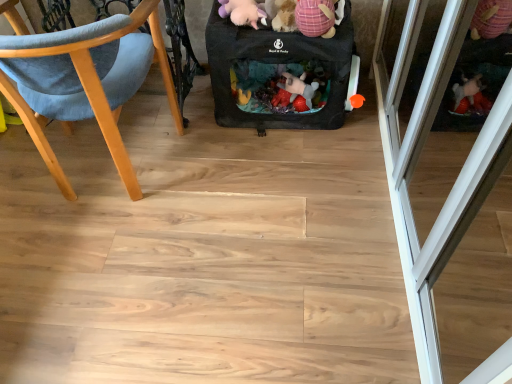
The image size is (512, 384). Describe the element at coordinates (88, 81) in the screenshot. I see `wooden chair at left` at that location.

Where is `purple plush toy at upper center, which is counted as the 2th toy, starting from the right`? This screenshot has width=512, height=384. purple plush toy at upper center, which is counted as the 2th toy, starting from the right is located at coordinates (242, 12).

This screenshot has width=512, height=384. What are the coordinates of `black fabric baby carriage at center` in the screenshot? It's located at (277, 73).

The height and width of the screenshot is (384, 512). There is a wooden chair at left. Find the location of `the 2nd toy above it (from the image's perspective)`. the 2nd toy above it (from the image's perspective) is located at coordinates (242, 12).

Is wooden chair at left to the right of purple plush toy at upper center, which is counted as the 2th toy, starting from the right, from the viewer's perspective?

No.

Which point is more distant from viewer, (51, 55) or (219, 12)?

Point (219, 12)

From a real-world perspective, is wooden chair at left positioned over purple plush toy at upper center, which is counted as the 2th toy, starting from the right, based on gravity?

No, from a real-world perspective, wooden chair at left is not over purple plush toy at upper center, which is counted as the 2th toy, starting from the right

Which is correct: purple plush toy at upper center, which is counted as the 2th toy, starting from the right, is inside black fabric baby carriage at center, or outside of it?

purple plush toy at upper center, which is counted as the 2th toy, starting from the right, lies outside black fabric baby carriage at center.

Who is taller, purple plush toy at upper center, which is counted as the 2th toy, starting from the right, or black fabric baby carriage at center?

With more height is black fabric baby carriage at center.

Is purple plush toy at upper center, which is counted as the 2th toy, starting from the right, oriented away from black fabric baby carriage at center?

No, purple plush toy at upper center, which is counted as the 2th toy, starting from the right, is not facing the opposite direction of black fabric baby carriage at center.

Is purple plush toy at upper center, which is the first toy from left to right, in contact with black fabric baby carriage at center?

No, purple plush toy at upper center, which is the first toy from left to right, is not in contact with black fabric baby carriage at center.

From the image's perspective, between transparent glass screen door at right and wooden chair at left, which one is located above?

wooden chair at left.

Based on the photo, considering the relative sizes of transparent glass screen door at right and wooden chair at left in the image provided, is transparent glass screen door at right thinner than wooden chair at left?

Yes.

Is transparent glass screen door at right facing towards wooden chair at left?

Yes, transparent glass screen door at right is facing wooden chair at left.

What are the coordinates of `chair above the transparent glass screen door at right (from the image's perspective)` in the screenshot? It's located at (88, 81).

Looking at the image, does transparent glass screen door at right seem bigger or smaller compared to purple plush toy at upper center, which is counted as the 2th toy, starting from the right?

In the image, transparent glass screen door at right appears to be larger than purple plush toy at upper center, which is counted as the 2th toy, starting from the right.

Relative to purple plush toy at upper center, which is the first toy from left to right, is transparent glass screen door at right in front or behind?

transparent glass screen door at right is positioned closer to the viewer than purple plush toy at upper center, which is the first toy from left to right.

Is transparent glass screen door at right wider than purple plush toy at upper center, which is counted as the 2th toy, starting from the right?

Yes.

Is pink plaid fabric stuffed animal at upper center, the second toy viewed from the left, facing away from transparent glass screen door at right?

pink plaid fabric stuffed animal at upper center, the second toy viewed from the left, does not have its back to transparent glass screen door at right.

Would you say transparent glass screen door at right is part of pink plaid fabric stuffed animal at upper center, the second toy viewed from the left,'s contents?

No, transparent glass screen door at right is not inside pink plaid fabric stuffed animal at upper center, the second toy viewed from the left.

Does pink plaid fabric stuffed animal at upper center, positioned as the first toy in right-to-left order, have a lesser height compared to transparent glass screen door at right?

Indeed, pink plaid fabric stuffed animal at upper center, positioned as the first toy in right-to-left order, has a lesser height compared to transparent glass screen door at right.

Consider the image. Considering the relative sizes of pink plaid fabric stuffed animal at upper center, positioned as the first toy in right-to-left order, and transparent glass screen door at right in the image provided, is pink plaid fabric stuffed animal at upper center, positioned as the first toy in right-to-left order, smaller than transparent glass screen door at right?

Correct, pink plaid fabric stuffed animal at upper center, positioned as the first toy in right-to-left order, occupies less space than transparent glass screen door at right.

Based on the photo, between pink plaid fabric stuffed animal at upper center, positioned as the first toy in right-to-left order, and purple plush toy at upper center, which is counted as the 2th toy, starting from the right, which one has more height?

With more height is pink plaid fabric stuffed animal at upper center, positioned as the first toy in right-to-left order.

From the image's perspective, does pink plaid fabric stuffed animal at upper center, the second toy viewed from the left, appear higher than purple plush toy at upper center, which is counted as the 2th toy, starting from the right?

No, from the image's perspective, pink plaid fabric stuffed animal at upper center, the second toy viewed from the left, is not over purple plush toy at upper center, which is counted as the 2th toy, starting from the right.

Identify the location of toy that is under the pink plaid fabric stuffed animal at upper center, positioned as the first toy in right-to-left order (from a real-world perspective). (242, 12).

Based on their sizes in the image, would you say pink plaid fabric stuffed animal at upper center, the second toy viewed from the left, is bigger or smaller than purple plush toy at upper center, which is counted as the 2th toy, starting from the right?

Considering their sizes, pink plaid fabric stuffed animal at upper center, the second toy viewed from the left, takes up more space than purple plush toy at upper center, which is counted as the 2th toy, starting from the right.

Are pink plaid fabric stuffed animal at upper center, positioned as the first toy in right-to-left order, and black fabric baby carriage at center located far from each other?

pink plaid fabric stuffed animal at upper center, positioned as the first toy in right-to-left order, is near black fabric baby carriage at center, not far away.

In the scene shown: Is pink plaid fabric stuffed animal at upper center, the second toy viewed from the left, bigger or smaller than black fabric baby carriage at center?

Clearly, pink plaid fabric stuffed animal at upper center, the second toy viewed from the left, is smaller in size than black fabric baby carriage at center.

From the image's perspective, between pink plaid fabric stuffed animal at upper center, the second toy viewed from the left, and black fabric baby carriage at center, which one is located above?

pink plaid fabric stuffed animal at upper center, the second toy viewed from the left.

Identify the location of the 2nd toy behind when counting from the wooden chair at left. Image resolution: width=512 pixels, height=384 pixels. (242, 12).

Where is `the 2nd toy positioned above the black fabric baby carriage at center (from the image's perspective)`? the 2nd toy positioned above the black fabric baby carriage at center (from the image's perspective) is located at coordinates (242, 12).

Which object lies nearer to the anchor point transparent glass screen door at right, purple plush toy at upper center, which is counted as the 2th toy, starting from the right, or pink plaid fabric stuffed animal at upper center, positioned as the first toy in right-to-left order?

Based on the image, pink plaid fabric stuffed animal at upper center, positioned as the first toy in right-to-left order, appears to be nearer to transparent glass screen door at right.

From the image, which object appears to be farther from transparent glass screen door at right, pink plaid fabric stuffed animal at upper center, the second toy viewed from the left, or black fabric baby carriage at center?

The object further to transparent glass screen door at right is pink plaid fabric stuffed animal at upper center, the second toy viewed from the left.

Based on their spatial positions, is purple plush toy at upper center, which is counted as the 2th toy, starting from the right, or black fabric baby carriage at center further from wooden chair at left?

Among the two, purple plush toy at upper center, which is counted as the 2th toy, starting from the right, is located further to wooden chair at left.

In the scene shown: Looking at the image, which one is located closer to pink plaid fabric stuffed animal at upper center, positioned as the first toy in right-to-left order, wooden chair at left or transparent glass screen door at right?

transparent glass screen door at right is closer to pink plaid fabric stuffed animal at upper center, positioned as the first toy in right-to-left order.

Based on their spatial positions, is purple plush toy at upper center, which is counted as the 2th toy, starting from the right, or pink plaid fabric stuffed animal at upper center, the second toy viewed from the left, closer to wooden chair at left?

Among the two, purple plush toy at upper center, which is counted as the 2th toy, starting from the right, is located nearer to wooden chair at left.

From the picture: Estimate the real-world distances between objects in this image. Which object is closer to black fabric baby carriage at center, wooden chair at left or pink plaid fabric stuffed animal at upper center, the second toy viewed from the left?

pink plaid fabric stuffed animal at upper center, the second toy viewed from the left, is positioned closer to the anchor black fabric baby carriage at center.

When comparing their distances from pink plaid fabric stuffed animal at upper center, positioned as the first toy in right-to-left order, does transparent glass screen door at right or black fabric baby carriage at center seem further?

Based on the image, transparent glass screen door at right appears to be further to pink plaid fabric stuffed animal at upper center, positioned as the first toy in right-to-left order.

Based on their spatial positions, is black fabric baby carriage at center or transparent glass screen door at right further from purple plush toy at upper center, which is counted as the 2th toy, starting from the right?

Based on the image, transparent glass screen door at right appears to be further to purple plush toy at upper center, which is counted as the 2th toy, starting from the right.

Find the location of a particular element. toy between transparent glass screen door at right and black fabric baby carriage at center in the front-back direction is located at coordinates (315, 17).

Find the location of a particular element. The image size is (512, 384). baby carriage situated between wooden chair at left and transparent glass screen door at right from left to right is located at coordinates (277, 73).

Identify the location of baby carriage between transparent glass screen door at right and purple plush toy at upper center, which is counted as the 2th toy, starting from the right, from front to back. The height and width of the screenshot is (384, 512). (277, 73).

At what (x,y) coordinates should I click in order to perform the action: click on baby carriage between wooden chair at left and pink plaid fabric stuffed animal at upper center, the second toy viewed from the left, from left to right. Please return your answer as a coordinate pair (x, y). Looking at the image, I should click on (277, 73).